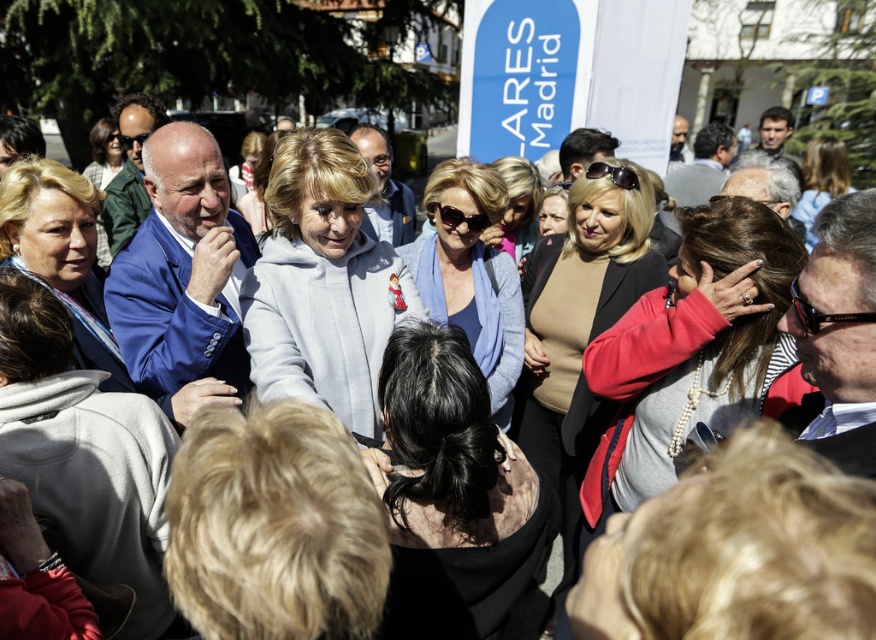
You are a photographer at the event and want to capture a photo that includes both the pearl necklace at center and the gray fleece jacket at center. Which object should you focus on first to ensure both are in the frame?

The pearl necklace at center is located below the gray fleece jacket at center, so you should focus on the gray fleece jacket at center first to ensure both are in the frame.

You are a photographer at this event and want to capture a closeup of the pearl necklace at center. You have a zoom lens that can focus on objects within a 0.5 unit radius. Is the point at coordinates point (696, 352) within the focus range of your lens?

The point (696, 352) is on pearl necklace at center, so yes, the lens can focus on it as it is within the 0.5 unit radius.

You are a photographer trying to capture a group photo of the gray fleece jacket at center and the matte black jacket at center. You want to ensure both jackets are clearly visible in the photo. Given their thickness, which jacket might you position closer to the camera to avoid one blocking the other?

The gray fleece jacket at center is thinner than the matte black jacket at center. To ensure both are visible, position the thinner gray fleece jacket at center closer to the camera so it doesn not block the thicker matte black jacket at center behind it.